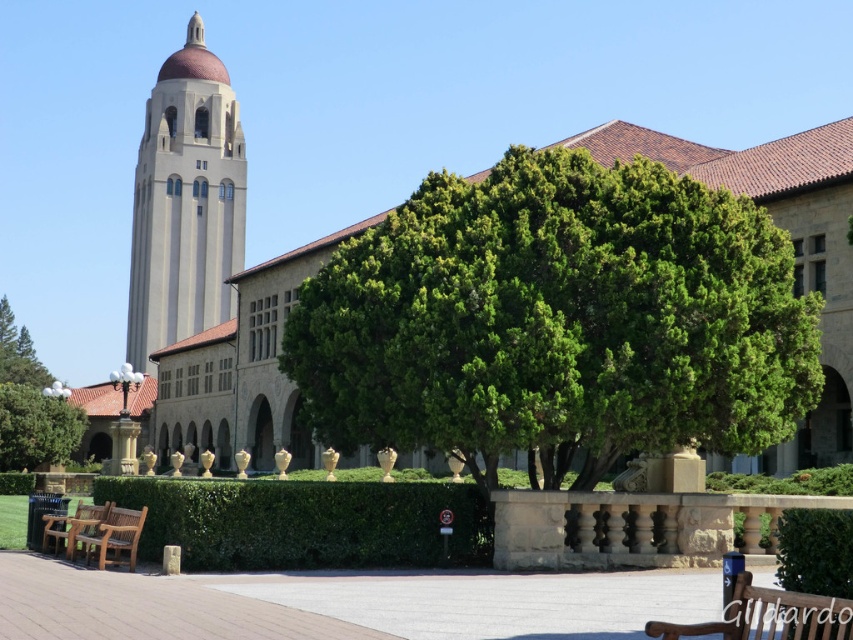
You are standing at the point labeled point (184, 202) in the image. What object are you facing?

You are facing the smooth beige tower at center left as the point (184, 202) corresponds to that location.

You are standing at the center of the garden and want to take a photo of the historic building with the green leafy tree at lower left in the frame. Based on their positions, will the tree be to the left or right side of the building in your photo?

The green leafy tree at lower left is located at point (36,428), which places it to the left side of the building in the photo.